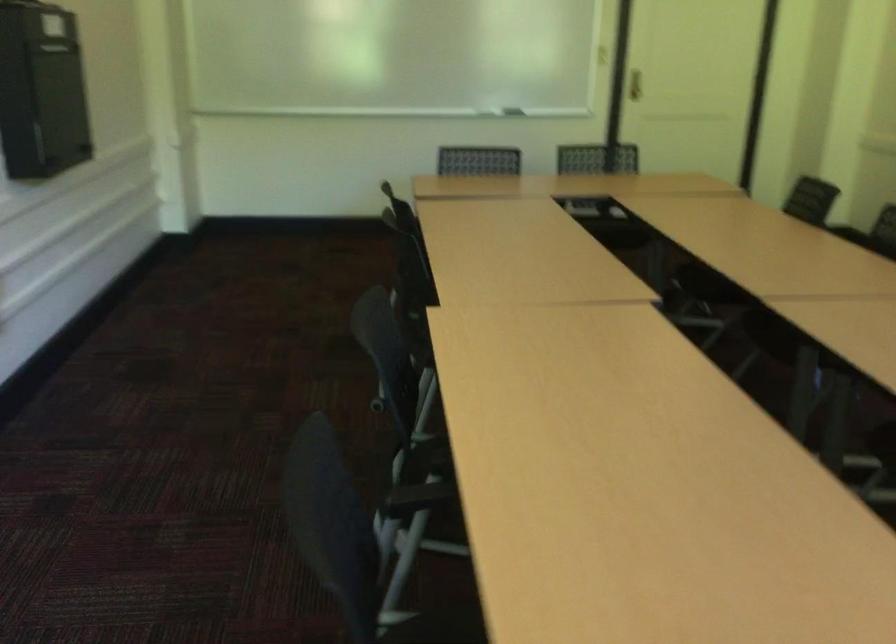
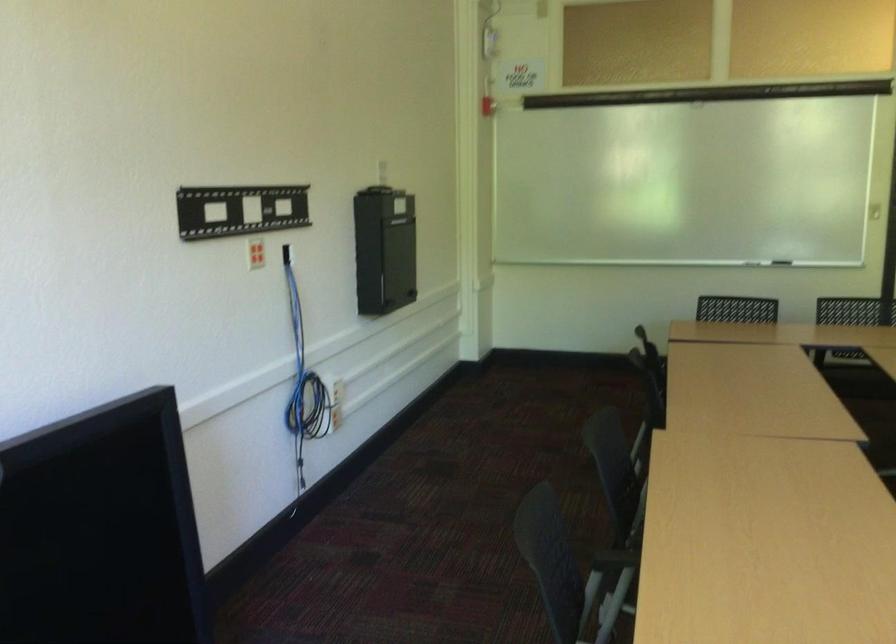
Question: The first image is from the beginning of the video and the second image is from the end. How did the camera likely rotate when shooting the video?

Choices:
 (A) Left
 (B) Right
 (C) Up
 (D) Down

Answer: (A)